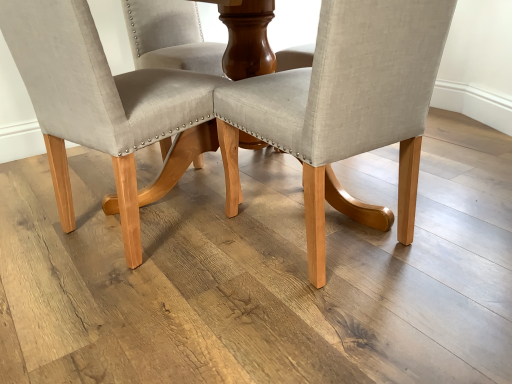
Question: Should I look upward or downward to see beige fabric chair at center, placed as the 1th chair when sorted from right to left?

Choices:
 (A) down
 (B) up

Answer: (B)

Question: Is beige fabric chair at center, which appears as the first chair when viewed from the left, placed right next to beige fabric chair at center, placed as the 1th chair when sorted from right to left?

Choices:
 (A) yes
 (B) no

Answer: (B)

Question: Is beige fabric chair at center, which appears as the first chair when viewed from the left, to the right of beige fabric chair at center, placed as the 1th chair when sorted from right to left, from the viewer's perspective?

Choices:
 (A) yes
 (B) no

Answer: (B)

Question: Could you tell me if beige fabric chair at center, which appears as the first chair when viewed from the left, is facing beige fabric chair at center, which ranks as the second chair in left-to-right order?

Choices:
 (A) yes
 (B) no

Answer: (B)

Question: Does beige fabric chair at center, which appears as the first chair when viewed from the left, have a lesser height compared to beige fabric chair at center, which ranks as the second chair in left-to-right order?

Choices:
 (A) yes
 (B) no

Answer: (B)

Question: Is beige fabric chair at center, the 2th chair from the right, facing away from beige fabric chair at center, placed as the 1th chair when sorted from right to left?

Choices:
 (A) yes
 (B) no

Answer: (B)

Question: From a real-world perspective, is beige fabric chair at center, the 2th chair from the right, positioned under beige fabric chair at center, placed as the 1th chair when sorted from right to left, based on gravity?

Choices:
 (A) yes
 (B) no

Answer: (B)

Question: Is beige fabric chair at center, which ranks as the second chair in left-to-right order, at the left side of beige fabric chair at center, which appears as the first chair when viewed from the left?

Choices:
 (A) yes
 (B) no

Answer: (B)

Question: Considering the relative positions of beige fabric chair at center, placed as the 1th chair when sorted from right to left, and beige fabric chair at center, which appears as the first chair when viewed from the left, in the image provided, is beige fabric chair at center, placed as the 1th chair when sorted from right to left, behind beige fabric chair at center, which appears as the first chair when viewed from the left,?

Choices:
 (A) no
 (B) yes

Answer: (A)

Question: Is beige fabric chair at center, which ranks as the second chair in left-to-right order, positioned before beige fabric chair at center, which appears as the first chair when viewed from the left?

Choices:
 (A) yes
 (B) no

Answer: (A)

Question: From the image's perspective, is beige fabric chair at center, which ranks as the second chair in left-to-right order, on beige fabric chair at center, the 2th chair from the right?

Choices:
 (A) no
 (B) yes

Answer: (A)

Question: Is beige fabric chair at center, placed as the 1th chair when sorted from right to left, bigger than beige fabric chair at center, which appears as the first chair when viewed from the left?

Choices:
 (A) no
 (B) yes

Answer: (A)

Question: Can we say beige fabric chair at center, placed as the 1th chair when sorted from right to left, lies outside beige fabric chair at center, the 2th chair from the right?

Choices:
 (A) yes
 (B) no

Answer: (A)

Question: From their relative heights in the image, would you say beige fabric chair at center, the 2th chair from the right, is taller or shorter than beige fabric chair at center, which ranks as the second chair in left-to-right order?

Choices:
 (A) short
 (B) tall

Answer: (B)